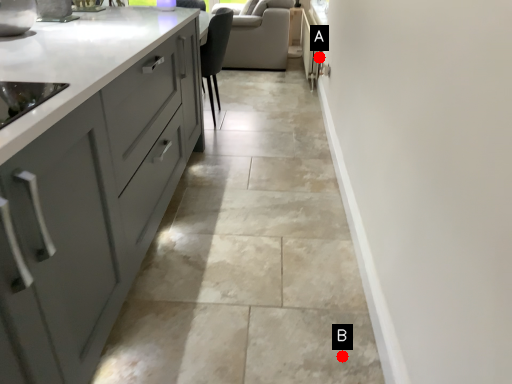
Question: Two points are circled on the image, labeled by A and B beside each circle. Which point is further to the camera?

Choices:
 (A) A is further
 (B) B is further

Answer: (A)